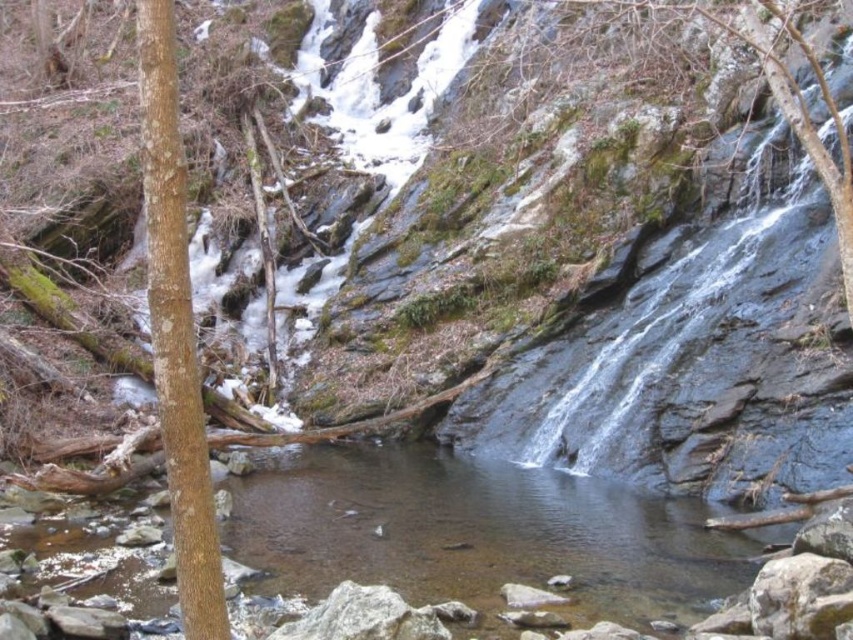
Who is more distant from viewer, [547,548] or [210,502]?

The point [547,548] is more distant.

Is clear water stream at center above brown rough bark tree at left?

Incorrect, clear water stream at center is not positioned above brown rough bark tree at left.

Where is `clear water stream at center`? The height and width of the screenshot is (640, 853). clear water stream at center is located at coordinates (477, 532).

I want to click on clear water stream at center, so click(x=477, y=532).